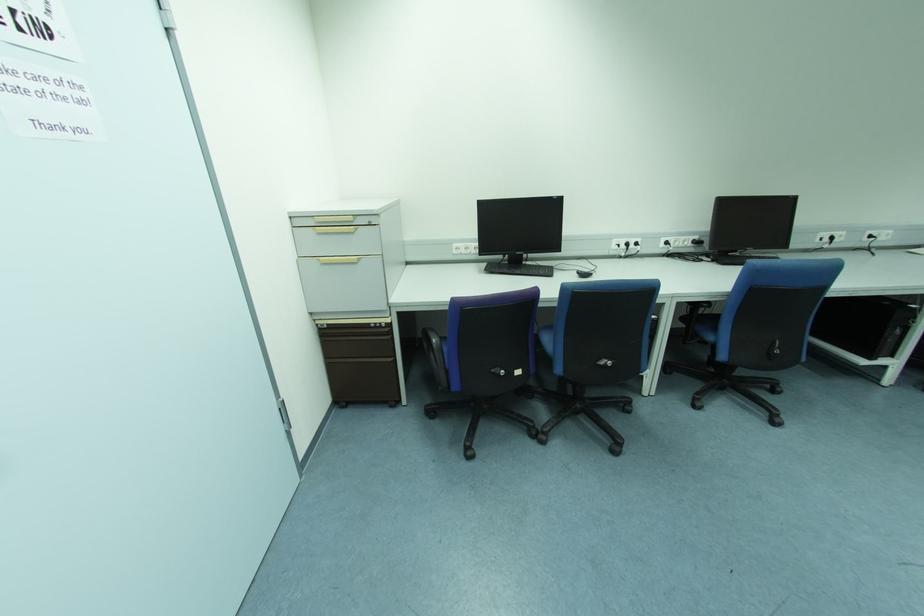
The image size is (924, 616). I want to click on blue chair sitting surface, so click(707, 326).